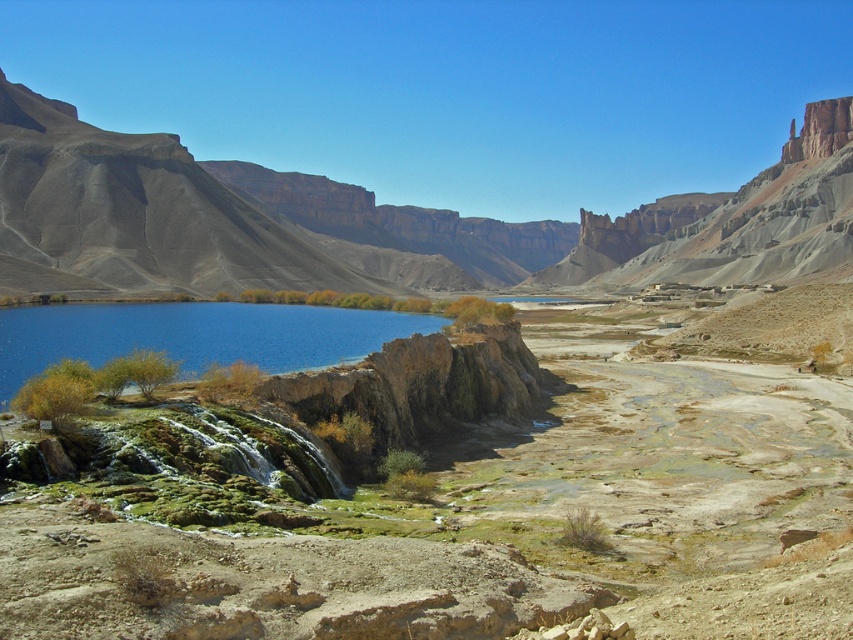
Question: Can you confirm if rustic brown cliff at left is bigger than blue water at center?

Choices:
 (A) no
 (B) yes

Answer: (B)

Question: Does rustic brown cliff at left have a smaller size compared to blue water at center?

Choices:
 (A) yes
 (B) no

Answer: (B)

Question: Which of the following is the farthest from the observer?

Choices:
 (A) rustic brown cliff at left
 (B) blue water at center

Answer: (A)

Question: Is rustic brown cliff at left wider than blue water at center?

Choices:
 (A) no
 (B) yes

Answer: (B)